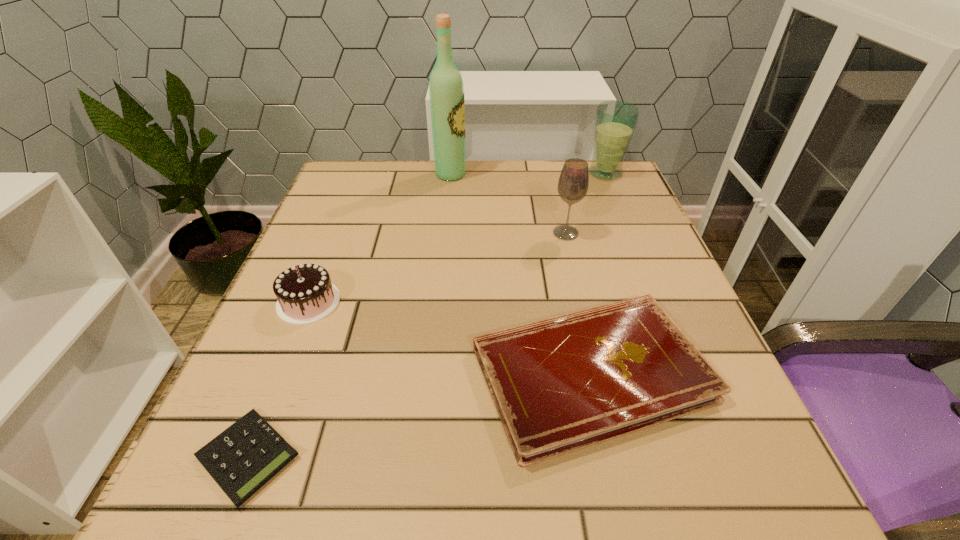
Identify the location of vacant area situated 0.100m on the back of the left glass drink container. (558, 201).

Find the location of `vacant space positioned on the right of the chocolate cake`. vacant space positioned on the right of the chocolate cake is located at coordinates (455, 302).

This screenshot has width=960, height=540. I want to click on free space located 0.170m on the left of the second shortest object, so click(362, 374).

Where is `vacant space located 0.080m on the right of the shortest object`? The image size is (960, 540). vacant space located 0.080m on the right of the shortest object is located at coordinates (361, 457).

Locate an element on the screen. wine bottle present at the far edge is located at coordinates (446, 91).

What are the coordinates of `glass at the far edge` in the screenshot? It's located at (615, 121).

Locate an element on the screen. This screenshot has width=960, height=540. notebook present at the near edge is located at coordinates (565, 383).

What are the coordinates of `calculator present at the near edge` in the screenshot? It's located at (244, 457).

The height and width of the screenshot is (540, 960). I want to click on chocolate cake present at the left edge, so click(x=305, y=294).

Find the location of a particular element. calculator that is at the left edge is located at coordinates (244, 457).